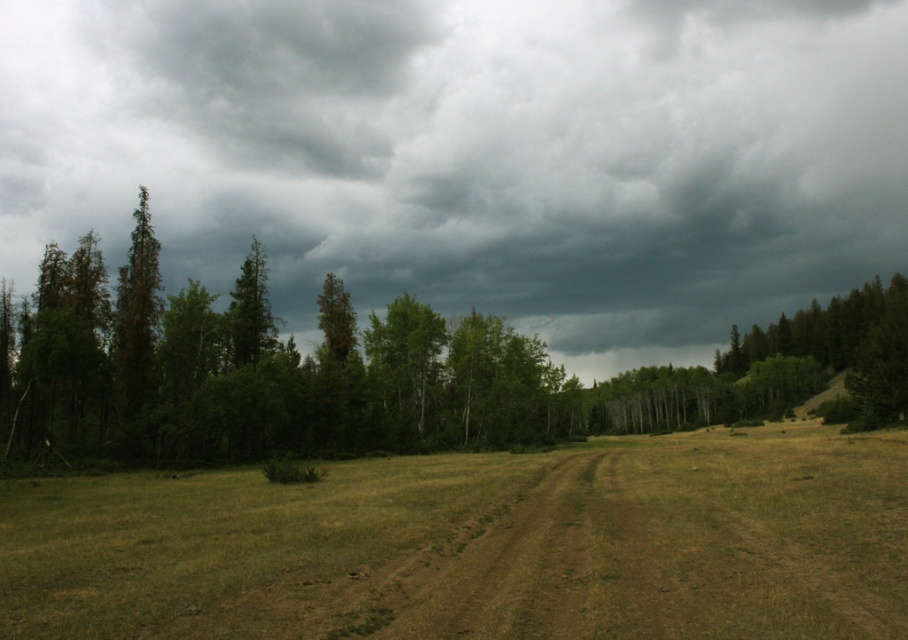
You are a hiker planning to walk along the brown dirt track at center. You notice a dark gray cloud at upper center moving towards you. Based on the scene, what direction should you head to avoid the cloud?

The dark gray cloud at upper center is located above the brown dirt track at center. Since the cloud is above the track, you should head in the direction away from the cloud, which would be either to the left or right along the dirt track to avoid it.

You are standing on the brown dirt track at center and looking towards the dense forest. Which direction should you turn to see the dark gray cloud at upper center?

You should turn to your right because the dark gray cloud at upper center is located to the right of the brown dirt track at center.

You are standing on the dirt path in the foreground of the scene. Looking up, you notice a specific point in the sky. What object is located at the coordinates point [472,156]?

The point [472,156] marks the location of a dark gray cloud at upper center.